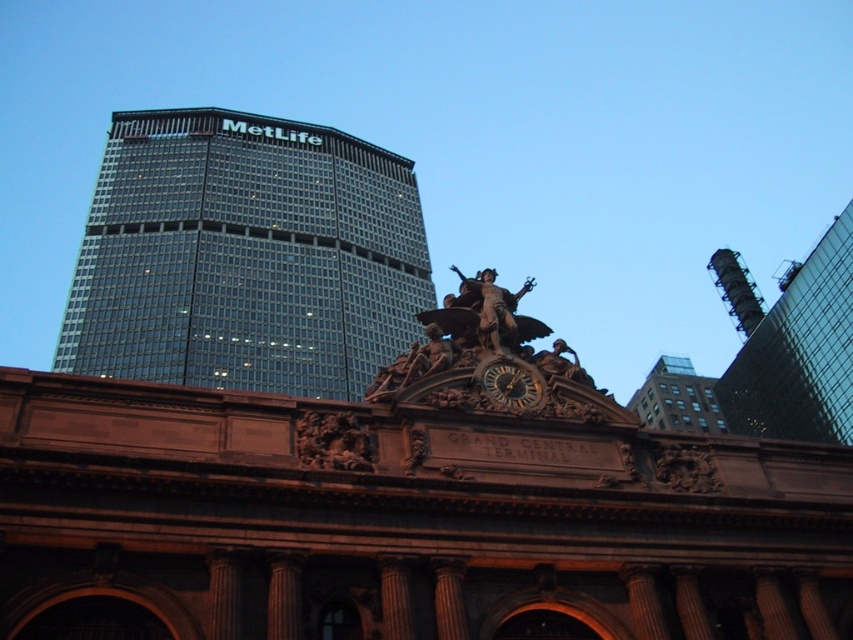
You are a tourist standing in front of the brown brick building at upper right and the wooden carved clock at center. Which object is closer to the ground?

The brown brick building at upper right is closer to the ground than the wooden carved clock at center because it is located below it.

You are an architect analyzing the image of Grand Central Terminal and the MetLife building. You need to determine which object occupies more visual space in the composition. Which one is bigger between the brown brick building at upper right and the wooden carved clock at center?

The brown brick building at upper right is larger in size than the wooden carved clock at center, so it occupies more visual space in the composition.

You are standing in front of the Grand Central Terminal and looking at the MetLife skyscraper in the background. You notice two points marked in the image. The first point is located at coordinates (700, 420), and the second point is at (498, 365). Which of these two points is closer to you?

Point (700, 420) is closer to you because it is further to the viewer than point (498, 365).